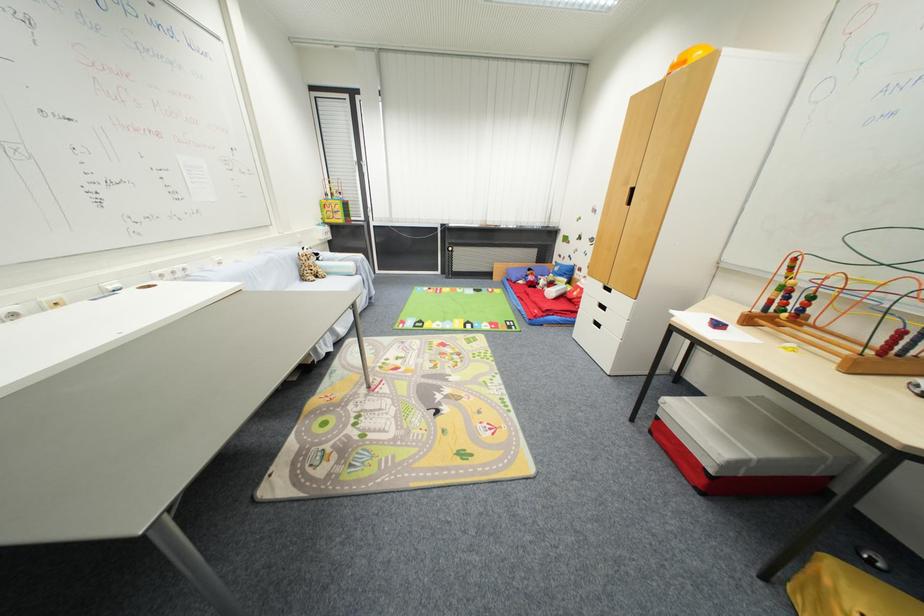
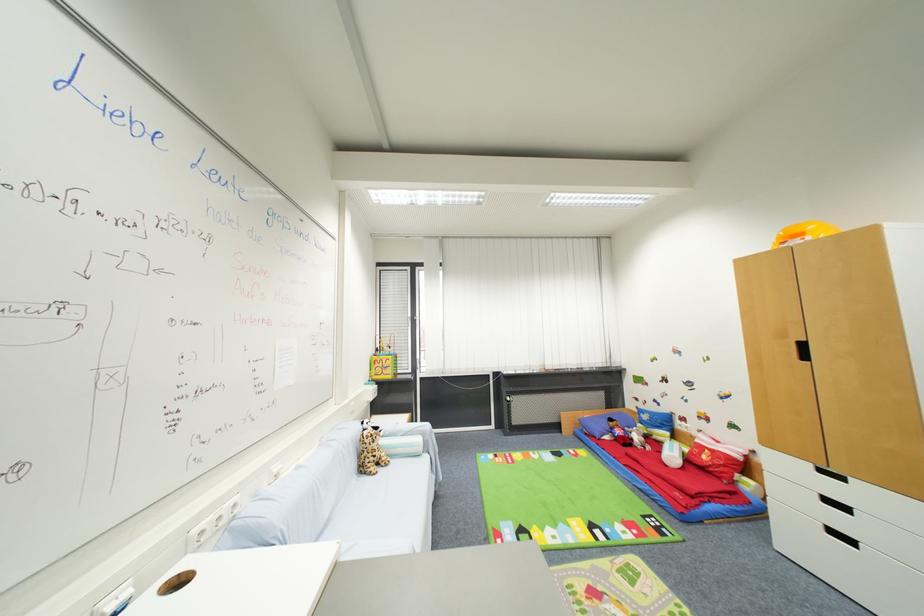
Find the pixel in the second image that matches pixel 606 286 in the first image.

(816, 467)